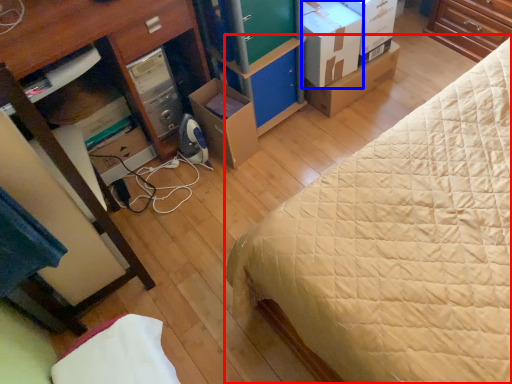
Question: Which of the following is the closest to the observer, bed (highlighted by a red box) or cardboard box (highlighted by a blue box)?

Choices:
 (A) bed
 (B) cardboard box

Answer: (A)